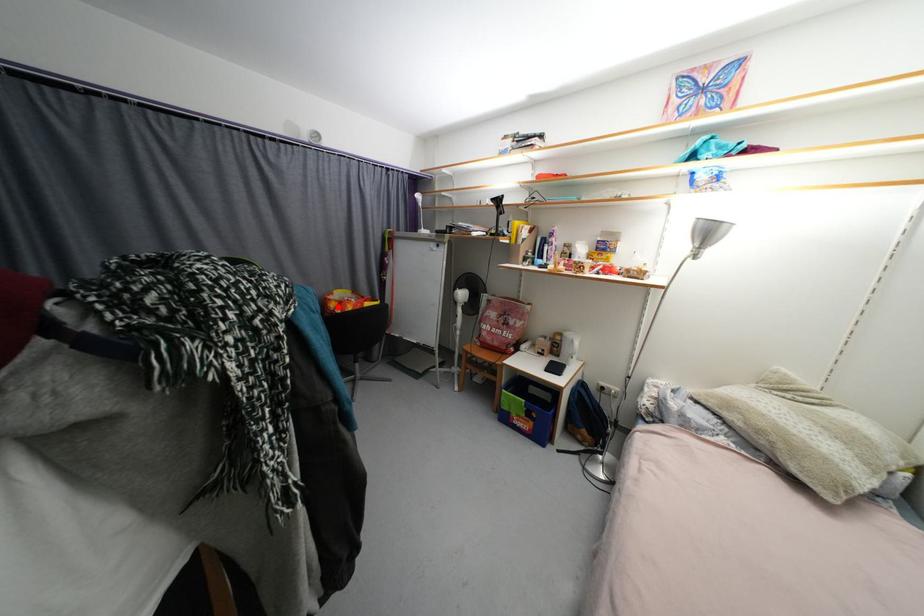
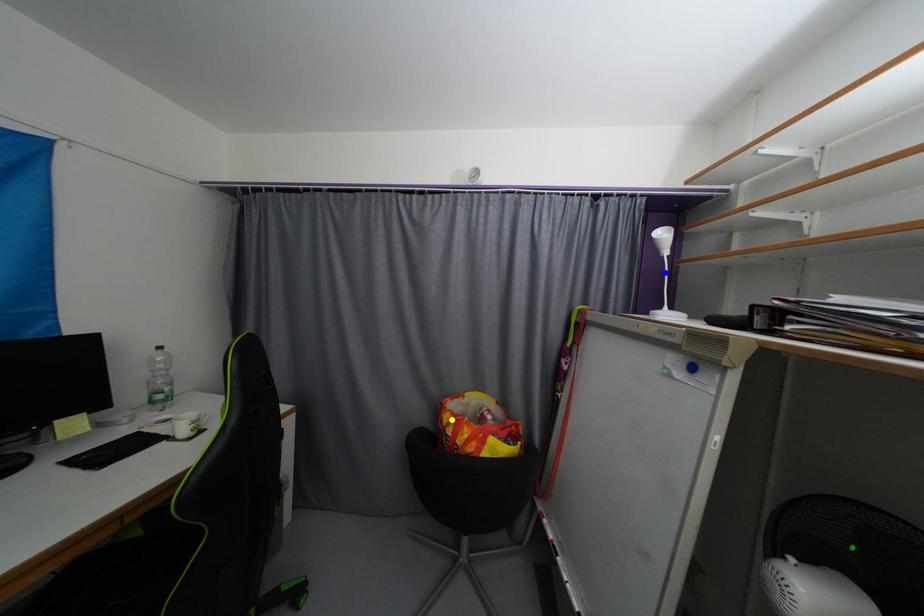
Question: I am providing you with two images of the same scene from different viewpoints. A red point is marked on the first image. You are given multiple points on the second image. Which spot in image 2 lines up with the point in image 1?

Choices:
 (A) blue point
 (B) yellow point
 (C) green point

Answer: (B)